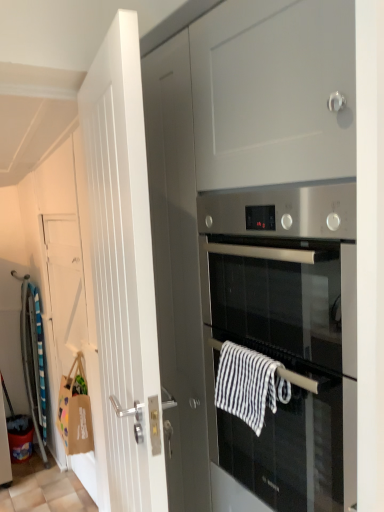
Question: Considering the positions of white wooden door at left, the 1th door viewed from the right, and brown paper bag at left, arranged as the second door when viewed from the right, in the image, is white wooden door at left, the 1th door viewed from the right, bigger or smaller than brown paper bag at left, arranged as the second door when viewed from the right,?

Choices:
 (A) big
 (B) small

Answer: (A)

Question: From a real-world perspective, relative to brown paper bag at left, arranged as the second door when viewed from the right, is white wooden door at left, placed as the 2th door when sorted from left to right, vertically above or below?

Choices:
 (A) below
 (B) above

Answer: (B)

Question: Estimate the real-world distances between objects in this image. Which object is farther from the black and white striped towel at center, positioned as the 1th hand towel in right-to-left order?

Choices:
 (A) striped cotton hand towel at left, placed as the 2th hand towel when sorted from right to left
 (B) stainless steel oven at center
 (C) white wooden door at left, the 1th door viewed from the right
 (D) brown paper bag at left, the 1th door when ordered from back to front

Answer: (A)

Question: Considering the real-world distances, which object is closest to the black and white striped towel at center, which ranks as the second hand towel in bottom-to-top order?

Choices:
 (A) striped cotton hand towel at left, placed as the 2th hand towel when sorted from right to left
 (B) stainless steel oven at center
 (C) white wooden door at left, the 1th door viewed from the right
 (D) brown paper bag at left, the 1th door when ordered from back to front

Answer: (B)